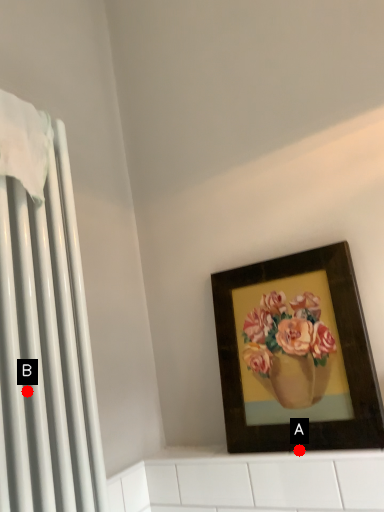
Question: Two points are circled on the image, labeled by A and B beside each circle. Which point is further to the camera?

Choices:
 (A) A is further
 (B) B is further

Answer: (A)